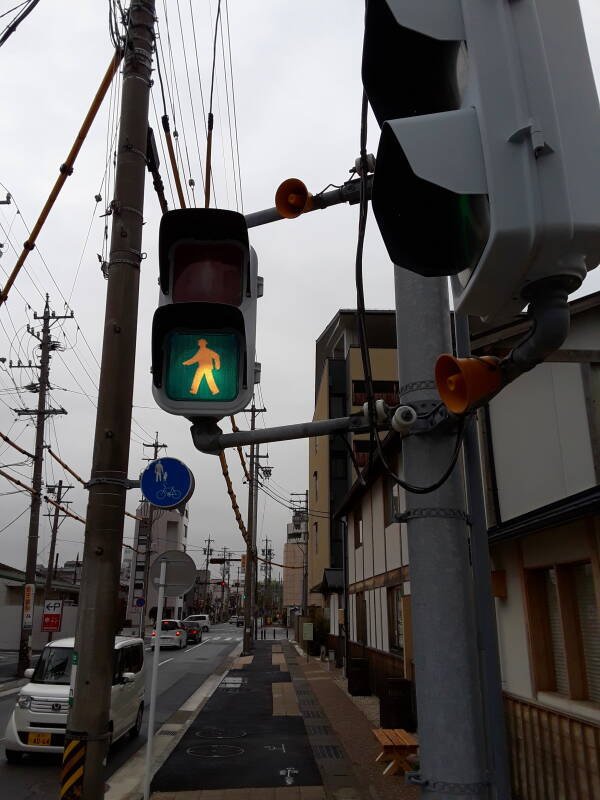
Where is `wall`? Image resolution: width=600 pixels, height=800 pixels. wall is located at coordinates (217, 370).